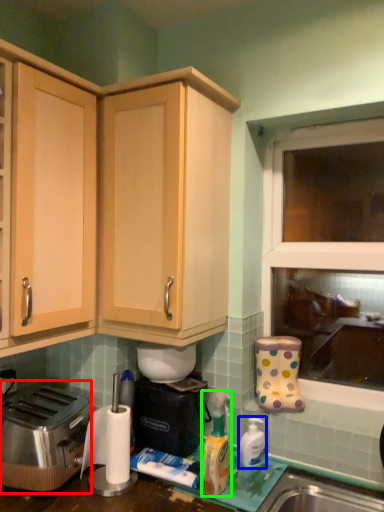
Question: Which object is the farthest from toaster (highlighted by a red box)? Choose among these: bottle (highlighted by a blue box) or bottle (highlighted by a green box).

Choices:
 (A) bottle
 (B) bottle

Answer: (A)